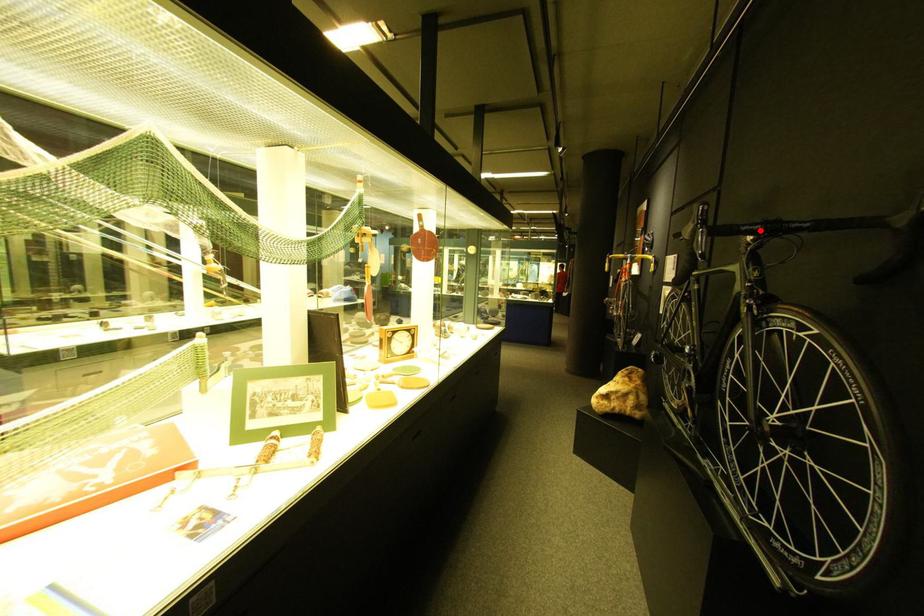
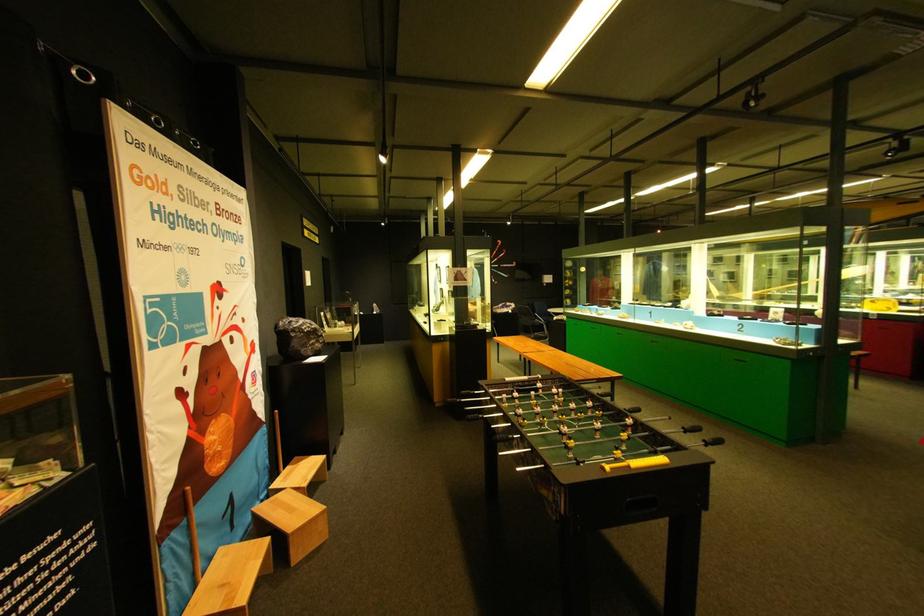
Question: I am providing you with two images of the same scene from different viewpoints. A red point is marked on the first image. At the location where the point appears in image 1, is it still visible in image 2?

Choices:
 (A) Yes
 (B) No

Answer: (B)